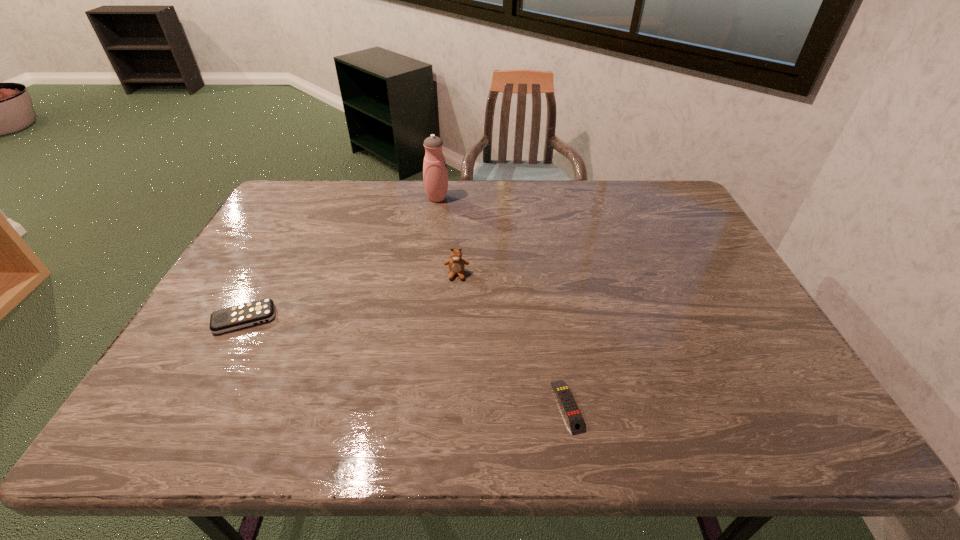
This screenshot has width=960, height=540. I want to click on blank space located 0.080m on the right of the farther remote control, so click(305, 319).

Locate an element on the screen. Image resolution: width=960 pixels, height=540 pixels. vacant space located 0.150m on the back of the shorter remote control is located at coordinates (555, 330).

Where is `object present at the far edge`? object present at the far edge is located at coordinates (435, 175).

Where is `object present at the near edge`? object present at the near edge is located at coordinates (574, 418).

This screenshot has height=540, width=960. I want to click on object at the left edge, so click(x=244, y=315).

The width and height of the screenshot is (960, 540). I want to click on vacant space at the far edge, so click(568, 208).

Where is `free space at the near edge of the desktop`? free space at the near edge of the desktop is located at coordinates (503, 441).

Identify the location of free region at the left edge. The image size is (960, 540). (261, 228).

You are a GUI agent. You are given a task and a screenshot of the screen. Output one action in this format:
    pyautogui.click(x=<x>, y=<y>)
    Task: Click on the free space at the right edge of the desktop
    The width and height of the screenshot is (960, 540).
    Given the screenshot: What is the action you would take?
    pyautogui.click(x=692, y=253)

Locate an element on the screen. Image resolution: width=960 pixels, height=540 pixels. free space at the far left corner of the desktop is located at coordinates (320, 195).